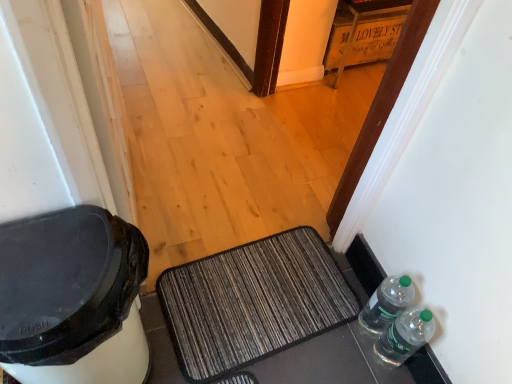
Find the location of a particular element. This screenshot has height=384, width=512. free space to the left of clear plastic bottles at lower right, which ranks as the first bottle in back-to-front order is located at coordinates (333, 302).